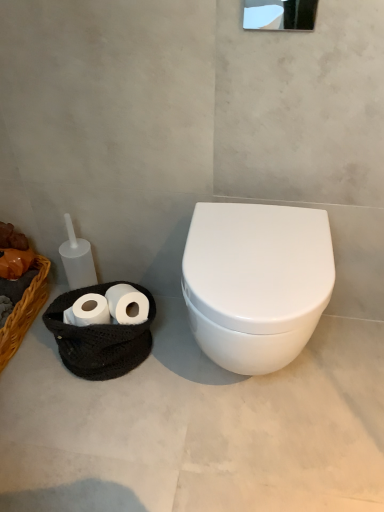
Identify the location of vacant area that is in front of white matte toilet paper at lower left. (105, 423).